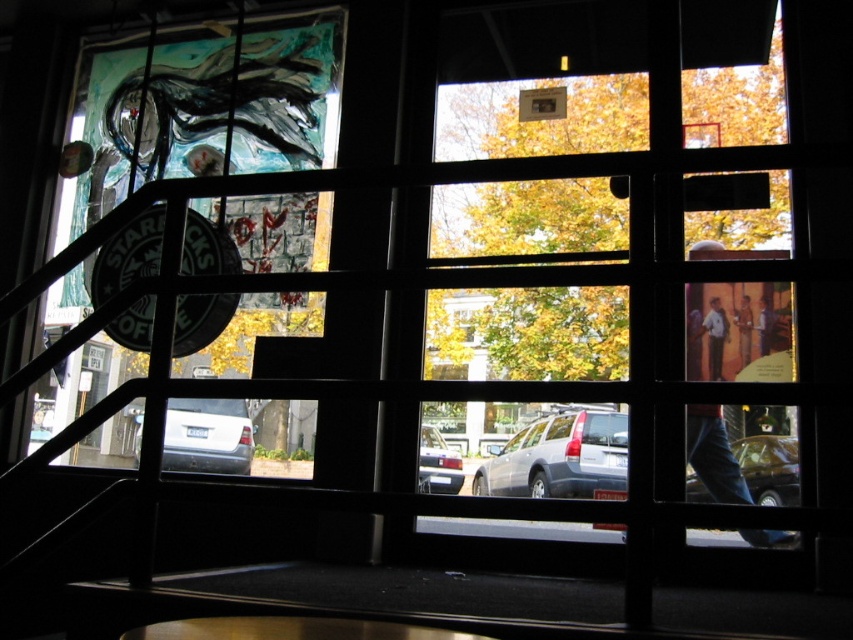
Question: Which point is closer to the camera?

Choices:
 (A) (199, 404)
 (B) (706, 342)
 (C) (737, 323)
 (D) (785, 460)

Answer: (D)

Question: Is light blue jeans at center below khaki cotton pants at center?

Choices:
 (A) yes
 (B) no

Answer: (A)

Question: Is satin silver sedan at center to the left of khaki cotton pants at center from the viewer's perspective?

Choices:
 (A) yes
 (B) no

Answer: (A)

Question: Estimate the real-world distances between objects in this image. Which object is farther from the metallic silver car at lower right?

Choices:
 (A) satin silver sedan at center
 (B) satin silver car at center
 (C) denim pants at lower right
 (D) khaki cotton pants at center

Answer: (A)

Question: Is metallic silver car at lower right to the right of light blue jeans at center from the viewer's perspective?

Choices:
 (A) no
 (B) yes

Answer: (B)

Question: Among these points, which one is farthest from the camera?

Choices:
 (A) (792, 472)
 (B) (601, 452)

Answer: (B)